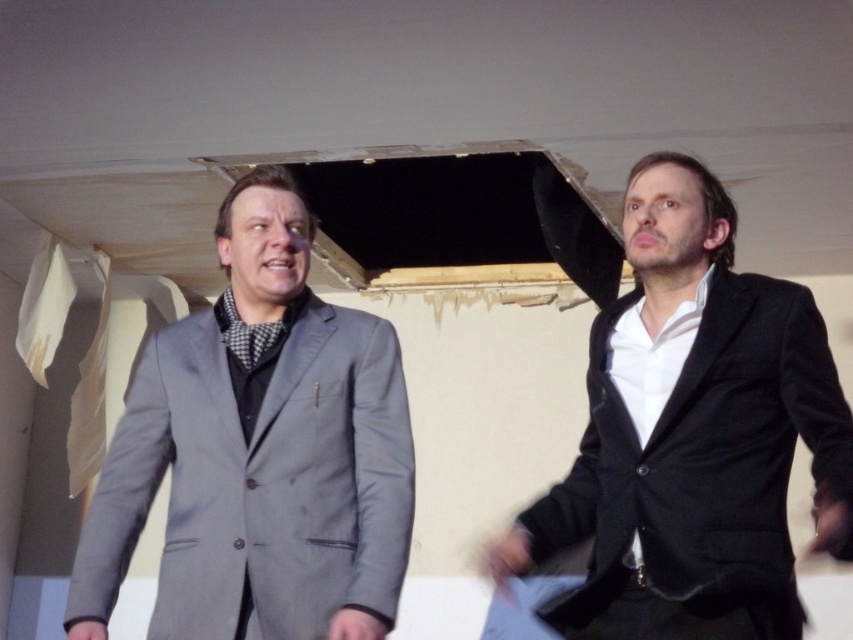
Question: Does gray wool suit at center lie behind black velvet suit at right?

Choices:
 (A) no
 (B) yes

Answer: (B)

Question: Which point is closer to the camera?

Choices:
 (A) (245, 339)
 (B) (647, 548)

Answer: (B)

Question: Where is gray wool suit at center located in relation to black velvet suit at right in the image?

Choices:
 (A) left
 (B) right

Answer: (A)

Question: Among these points, which one is nearest to the camera?

Choices:
 (A) (169, 358)
 (B) (682, 532)

Answer: (B)

Question: Which point is closer to the camera?

Choices:
 (A) black velvet suit at right
 (B) gray wool suit at center

Answer: (A)

Question: Can you confirm if gray wool suit at center is positioned below black velvet suit at right?

Choices:
 (A) yes
 (B) no

Answer: (A)